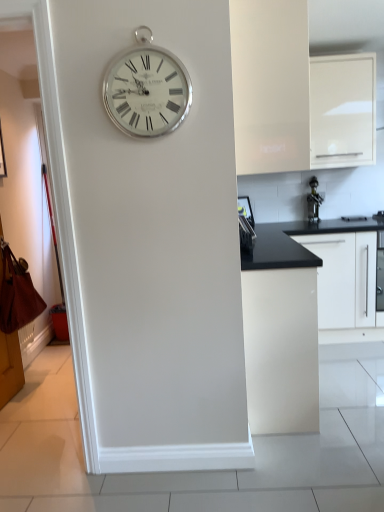
Question: Which direction should I rotate to look at white matte cabinet at upper center, which appears as the fourth cabinetry when viewed from the right?

Choices:
 (A) right
 (B) left

Answer: (A)

Question: Is white glossy cabinet at upper right, acting as the 2th cabinetry starting from the right, taller than satin black knife block at right, which appears as the 2th appliance when viewed from the right?

Choices:
 (A) yes
 (B) no

Answer: (A)

Question: Is white glossy cabinet at upper right, placed as the 3th cabinetry when sorted from left to right, not inside satin black knife block at right, positioned as the 2th appliance in back-to-front order?

Choices:
 (A) yes
 (B) no

Answer: (A)

Question: Considering the relative sizes of white glossy cabinet at upper right, placed as the 3th cabinetry when sorted from left to right, and satin black knife block at right, which appears as the 2th appliance when viewed from the right, in the image provided, is white glossy cabinet at upper right, placed as the 3th cabinetry when sorted from left to right, smaller than satin black knife block at right, which appears as the 2th appliance when viewed from the right,?

Choices:
 (A) no
 (B) yes

Answer: (A)

Question: Is white glossy cabinet at upper right, acting as the 2th cabinetry starting from the right, not close to satin black knife block at right, which appears as the 2th appliance when viewed from the right?

Choices:
 (A) yes
 (B) no

Answer: (B)

Question: Is the position of white glossy cabinet at upper right, acting as the 2th cabinetry starting from the right, more distant than that of satin black knife block at right, which appears as the 2th appliance when viewed from the right?

Choices:
 (A) no
 (B) yes

Answer: (B)

Question: From the image's perspective, is white glossy cabinet at upper right, placed as the 3th cabinetry when sorted from left to right, over satin black knife block at right, the first appliance when ordered from left to right?

Choices:
 (A) no
 (B) yes

Answer: (B)

Question: From a real-world perspective, does white glossy cabinet at center, the third cabinetry when ordered from right to left, sit lower than white glossy cabinet at upper right, placed as the 3th cabinetry when sorted from left to right?

Choices:
 (A) no
 (B) yes

Answer: (B)

Question: Is white glossy cabinet at upper right, placed as the 3th cabinetry when sorted from left to right, inside white glossy cabinet at center, which ranks as the second cabinetry in left-to-right order?

Choices:
 (A) yes
 (B) no

Answer: (B)

Question: From a real-world perspective, is white glossy cabinet at center, which ranks as the second cabinetry in left-to-right order, on top of white glossy cabinet at upper right, acting as the 2th cabinetry starting from the right?

Choices:
 (A) yes
 (B) no

Answer: (B)

Question: Could you tell me if white glossy cabinet at center, which ranks as the second cabinetry in left-to-right order, is facing white glossy cabinet at upper right, acting as the 2th cabinetry starting from the right?

Choices:
 (A) yes
 (B) no

Answer: (B)

Question: Is white glossy cabinet at center, the third cabinetry when ordered from right to left, closer to the viewer compared to white glossy cabinet at upper right, acting as the 2th cabinetry starting from the right?

Choices:
 (A) yes
 (B) no

Answer: (A)

Question: Is white glossy cabinet at center, which ranks as the second cabinetry in left-to-right order, to the left of white glossy cabinet at upper right, acting as the 2th cabinetry starting from the right, from the viewer's perspective?

Choices:
 (A) no
 (B) yes

Answer: (B)

Question: Can you confirm if white matte cabinet at upper center, which appears as the fourth cabinetry when viewed from the right, is bigger than silver metallic clock at upper center?

Choices:
 (A) no
 (B) yes

Answer: (B)